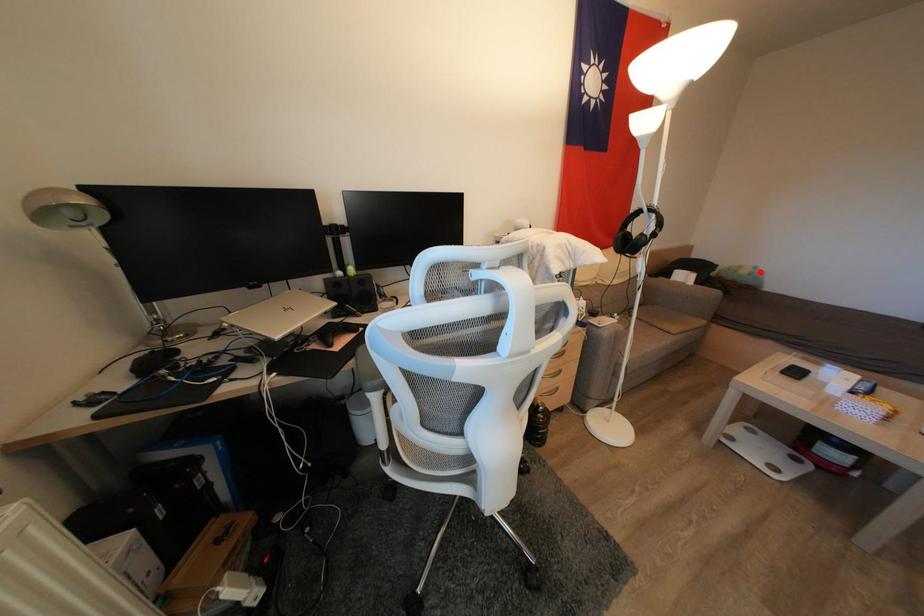
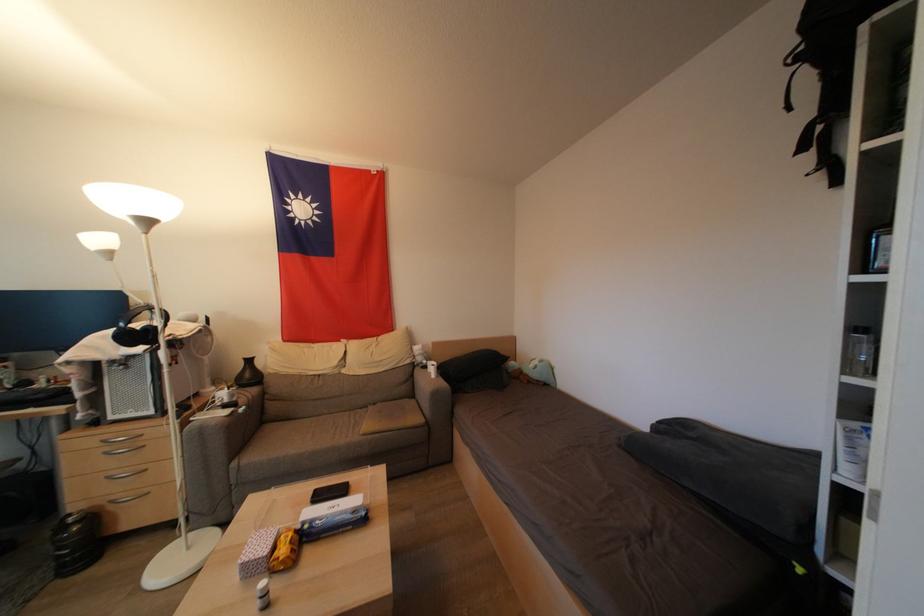
Question: I am providing you with two images of the same scene from different viewpoints. A red point is marked on the first image. Is the red point's position out of view in image 2?

Choices:
 (A) Yes
 (B) No

Answer: (B)